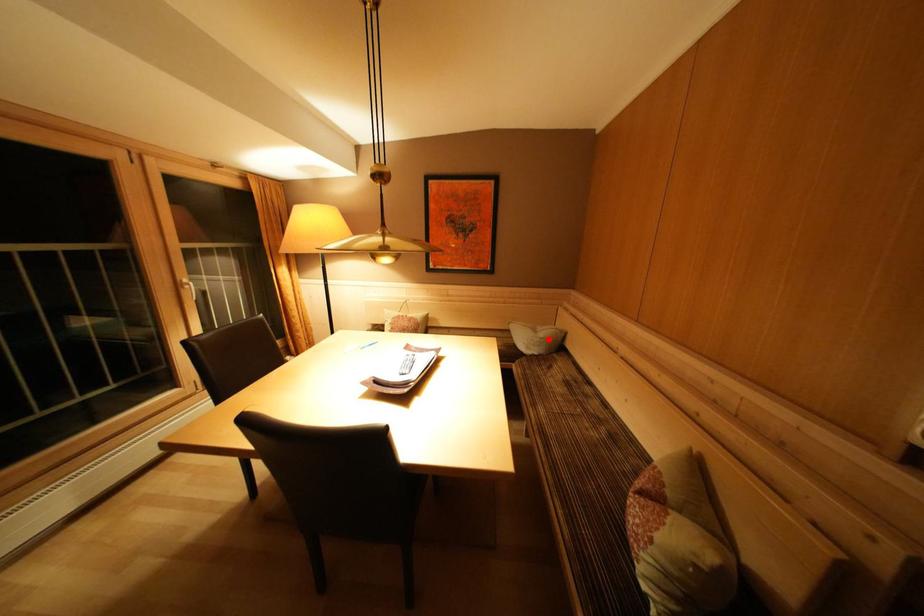
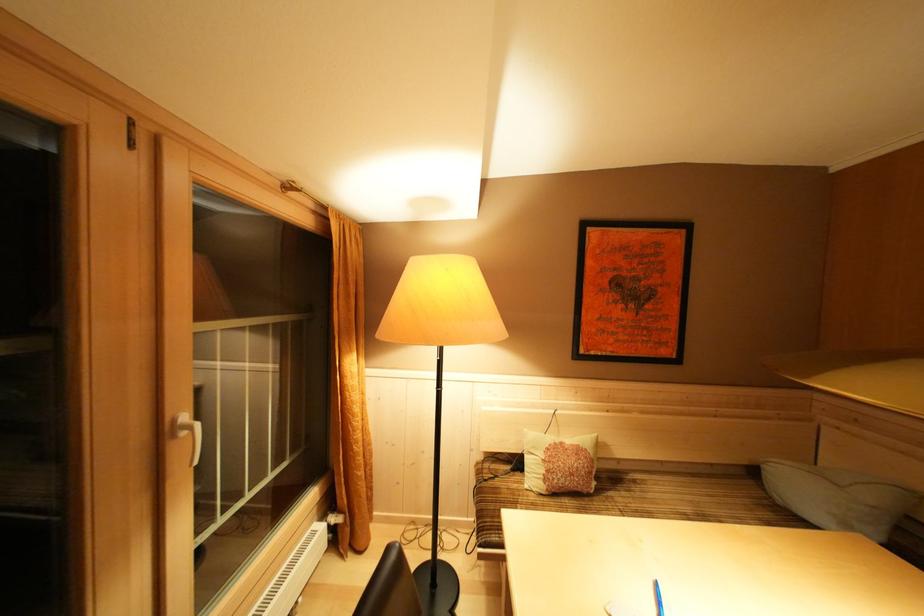
Question: I am providing you with two images of the same scene from different viewpoints. Image1 has a red point marked. In image2, the corresponding 3D location appears at what relative position? Reply with the corresponding letter.

Choices:
 (A) Closer
 (B) Farther

Answer: (A)